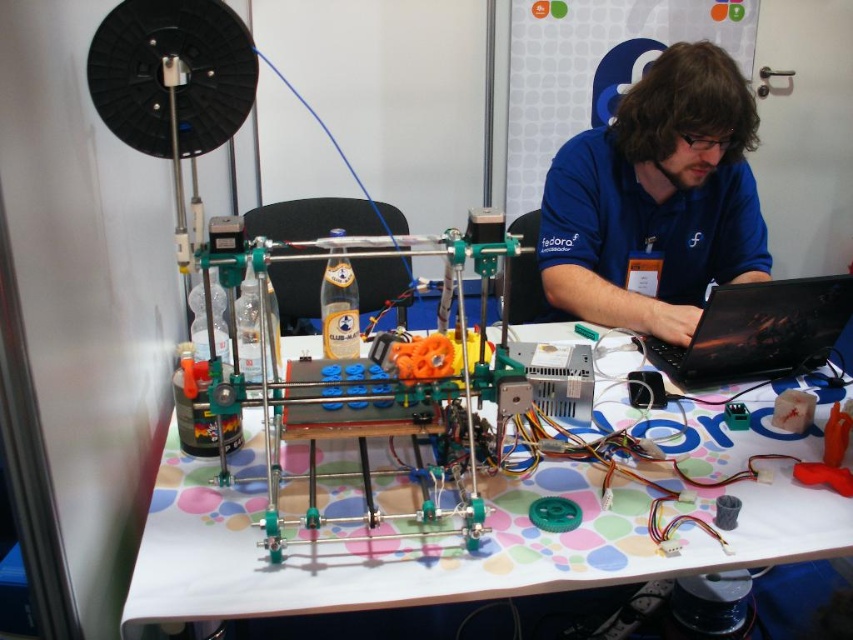
You are a photographer taking a picture of the workspace. The polka dot tablecloth at center and the blue fabric shirt at center are both in the frame. Which object is positioned closer to the camera?

The polka dot tablecloth at center is closer to the viewer than the blue fabric shirt at center, so it is positioned closer to the camera.

You are a tailor measuring a customer for a new shirt. The customer is wearing a blue fabric shirt at center and sitting at a table covered by a polka dot tablecloth at center. Which item is shorter in length?

The polka dot tablecloth at center is shorter than the blue fabric shirt at center.

You are a technician who needs to reach the black glossy laptop at center without moving the blue fabric shirt at center. Can you do it if your hand can extend 10 inches?

The blue fabric shirt at center is 10.52 inches from the black glossy laptop at center. Since your hand can only extend 10 inches, you cannot reach the laptop without moving the shirt.